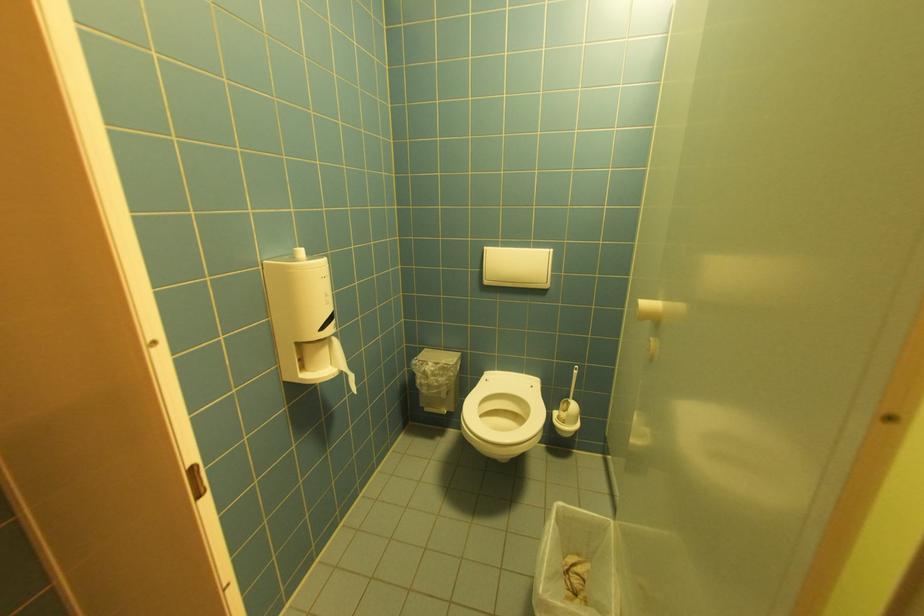
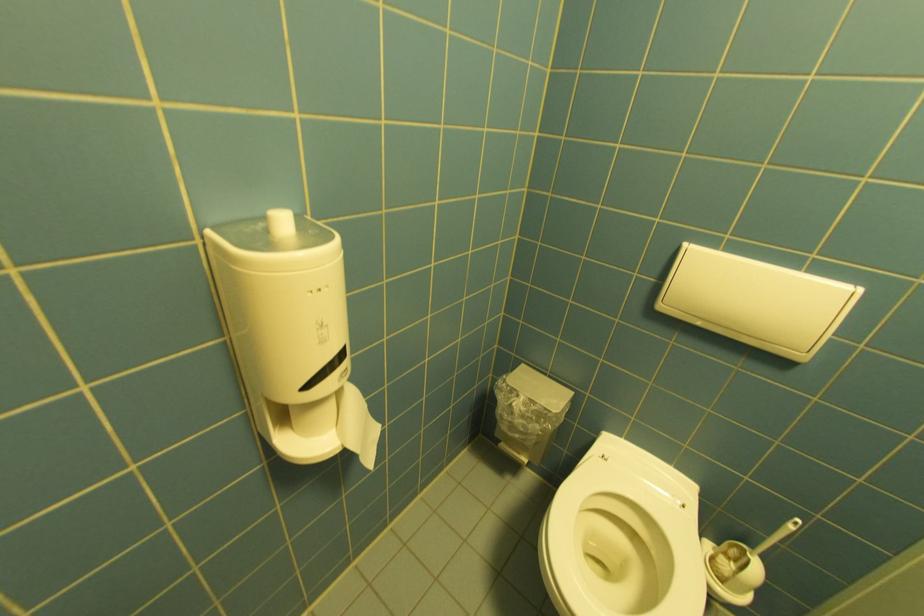
Question: The images are taken continuously from a first-person perspective. In which direction is your viewpoint rotating?

Choices:
 (A) Left
 (B) Right
 (C) Up
 (D) Down

Answer: (A)